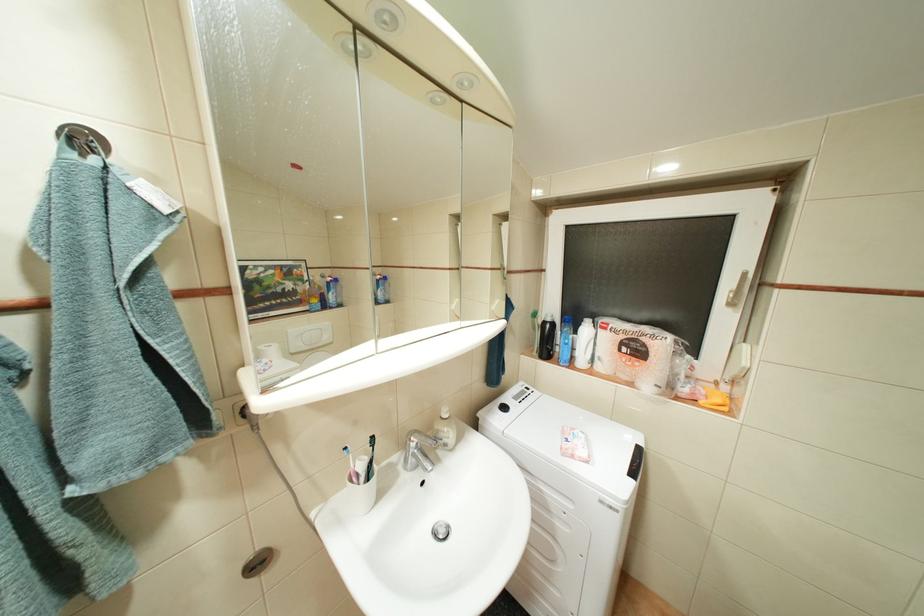
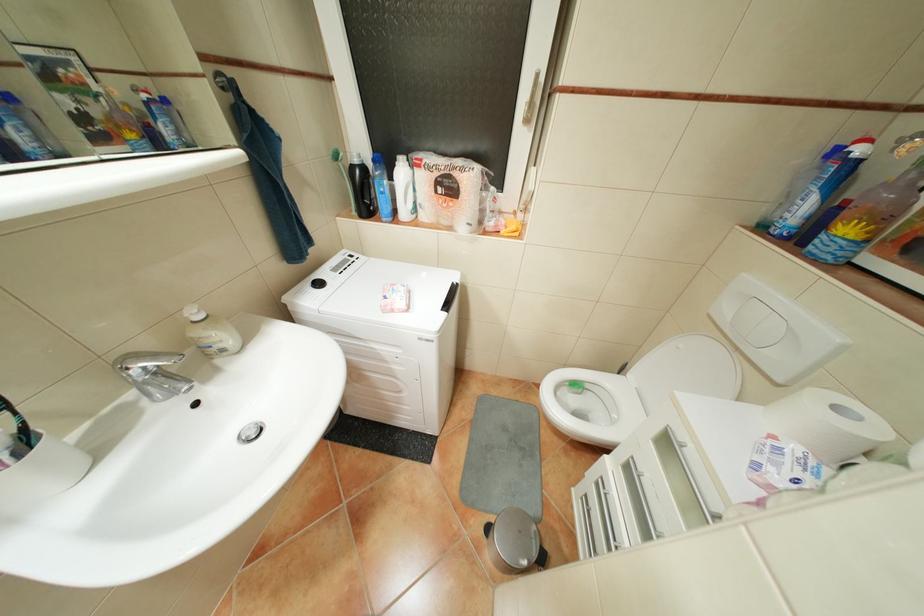
Find the pixel in the second image that matches the point at 409,467 in the first image.

(154, 400)